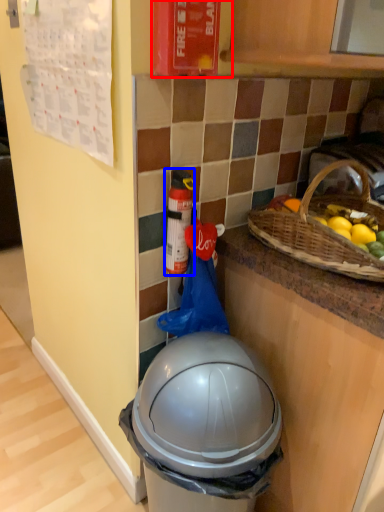
Question: Which object is closer to the camera taking this photo, fire extinguisher (highlighted by a red box) or bottle (highlighted by a blue box)?

Choices:
 (A) fire extinguisher
 (B) bottle

Answer: (A)